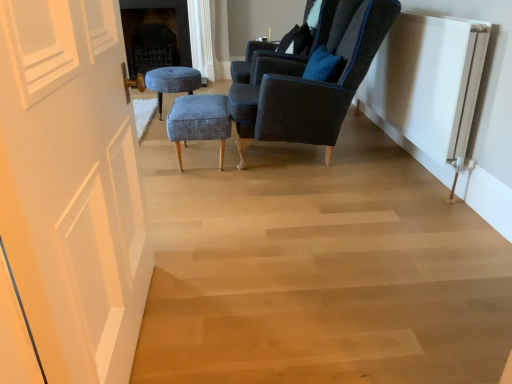
Image resolution: width=512 pixels, height=384 pixels. What are the coordinates of `free spot in front of white ribbed radiator at right` in the screenshot? It's located at (395, 216).